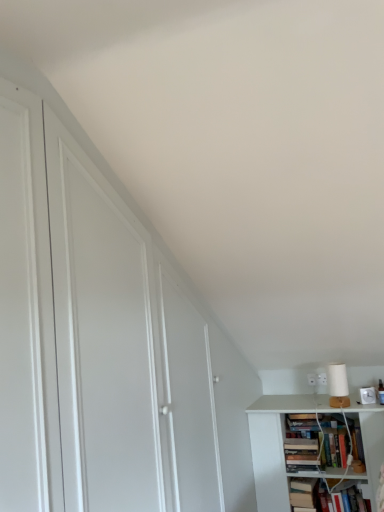
Where is `white matte lamp at upper right`? This screenshot has width=384, height=512. white matte lamp at upper right is located at coordinates point(338,385).

What are the coordinates of `hardcover book at lower right, the second book when ordered from right to left` in the screenshot? It's located at (303, 492).

Identify the location of white matte lamp at upper right. (338, 385).

Does white matte lamp at upper right contain hardcover book at lower right, which ranks as the second book in left-to-right order?

No.

From the image's perspective, is white matte lamp at upper right above hardcover book at lower right, which is counted as the first book, starting from the right?

Yes, from the image's perspective, white matte lamp at upper right is on top of hardcover book at lower right, which is counted as the first book, starting from the right.

Does point (340, 380) lie behind point (309, 505)?

Yes, it is.

Does white matte lamp at upper right have a lesser height compared to hardcover book at lower right, which ranks as the second book in left-to-right order?

Incorrect, the height of white matte lamp at upper right does not fall short of that of hardcover book at lower right, which ranks as the second book in left-to-right order.

Identify the location of book that is the 2nd one when counting forward from the white matte lamp at upper right. The height and width of the screenshot is (512, 384). (326, 496).

Consider the image. Considering the sizes of objects hardcover book at lower right, which ranks as the second book in left-to-right order, and white matte lamp at upper right in the image provided, who is taller, hardcover book at lower right, which ranks as the second book in left-to-right order, or white matte lamp at upper right?

white matte lamp at upper right.

From a real-world perspective, which object rests below the other?

From a 3D spatial view, hardcover book at lower right, which ranks as the second book in left-to-right order, is below.

Is hardcover book at lower right, which is the first book in left-to-right order, beside white matte lamp at upper right?

No, hardcover book at lower right, which is the first book in left-to-right order, is not in contact with white matte lamp at upper right.

Is hardcover book at lower right, the second book when ordered from right to left, positioned beyond the bounds of white matte lamp at upper right?

Absolutely, hardcover book at lower right, the second book when ordered from right to left, is external to white matte lamp at upper right.

Does hardcover book at lower right, which is the first book in left-to-right order, have a greater height compared to white matte lamp at upper right?

Yes, hardcover book at lower right, which is the first book in left-to-right order, is taller than white matte lamp at upper right.

From the image's perspective, is hardcover book at lower right, which ranks as the second book in left-to-right order, on top of hardcover book at lower right, which is the first book in left-to-right order?

No, from the image's perspective, hardcover book at lower right, which ranks as the second book in left-to-right order, is not above hardcover book at lower right, which is the first book in left-to-right order.

Which object is positioned more to the right, hardcover book at lower right, which is counted as the first book, starting from the right, or hardcover book at lower right, which is the first book in left-to-right order?

From the viewer's perspective, hardcover book at lower right, which is counted as the first book, starting from the right, appears more on the right side.

In order to click on book below the hardcover book at lower right, which is the first book in left-to-right order (from a real-world perspective) in this screenshot , I will do `click(326, 496)`.

Can you see hardcover book at lower right, which ranks as the second book in left-to-right order, touching hardcover book at lower right, the second book when ordered from right to left?

Absolutely, hardcover book at lower right, which ranks as the second book in left-to-right order, is next to and touching hardcover book at lower right, the second book when ordered from right to left.

Is white matte lamp at upper right to the left or to the right of hardcover book at lower right, which is the first book in left-to-right order, in the image?

Clearly, white matte lamp at upper right is on the right of hardcover book at lower right, which is the first book in left-to-right order, in the image.

From the image's perspective, would you say white matte lamp at upper right is shown under hardcover book at lower right, which is the first book in left-to-right order?

Actually, white matte lamp at upper right appears above hardcover book at lower right, which is the first book in left-to-right order, in the image.

Consider the image. Considering the sizes of objects white matte lamp at upper right and hardcover book at lower right, which is the first book in left-to-right order, in the image provided, who is smaller, white matte lamp at upper right or hardcover book at lower right, which is the first book in left-to-right order,?

white matte lamp at upper right is smaller.

From a real-world perspective, is white matte lamp at upper right on top of hardcover book at lower right, the second book when ordered from right to left?

Yes, from a real-world perspective, white matte lamp at upper right is on top of hardcover book at lower right, the second book when ordered from right to left.

Where is `book located in front of the hardcover book at lower right, which is the first book in left-to-right order`? book located in front of the hardcover book at lower right, which is the first book in left-to-right order is located at coordinates (326, 496).

In the scene shown: Is hardcover book at lower right, which is the first book in left-to-right order, in front of hardcover book at lower right, which ranks as the second book in left-to-right order?

No, hardcover book at lower right, which is the first book in left-to-right order, is behind hardcover book at lower right, which ranks as the second book in left-to-right order.

Does hardcover book at lower right, which is the first book in left-to-right order, have a greater height compared to hardcover book at lower right, which is counted as the first book, starting from the right?

Yes, hardcover book at lower right, which is the first book in left-to-right order, is taller than hardcover book at lower right, which is counted as the first book, starting from the right.

Image resolution: width=384 pixels, height=512 pixels. In order to click on book to the right of white matte lamp at upper right in this screenshot , I will do `click(326, 496)`.

From a real-world perspective, count 2nd books downward from the white matte lamp at upper right and point to it. Please provide its 2D coordinates.

[(326, 496)]

When comparing their distances from white matte lamp at upper right, does hardcover book at lower right, the second book when ordered from right to left, or hardcover book at lower right, which is counted as the first book, starting from the right, seem further?

hardcover book at lower right, the second book when ordered from right to left, is further to white matte lamp at upper right.

Considering their positions, is hardcover book at lower right, which is the first book in left-to-right order, positioned closer to hardcover book at lower right, which ranks as the second book in left-to-right order, than white matte lamp at upper right?

hardcover book at lower right, which is the first book in left-to-right order, is positioned closer to the anchor hardcover book at lower right, which ranks as the second book in left-to-right order.

Which object lies further to the anchor point white matte lamp at upper right, hardcover book at lower right, which ranks as the second book in left-to-right order, or hardcover book at lower right, the second book when ordered from right to left?

The object further to white matte lamp at upper right is hardcover book at lower right, the second book when ordered from right to left.

Which object lies further to the anchor point hardcover book at lower right, the second book when ordered from right to left, white matte lamp at upper right or hardcover book at lower right, which ranks as the second book in left-to-right order?

Based on the image, white matte lamp at upper right appears to be further to hardcover book at lower right, the second book when ordered from right to left.

Based on their spatial positions, is hardcover book at lower right, which ranks as the second book in left-to-right order, or white matte lamp at upper right closer to hardcover book at lower right, the second book when ordered from right to left?

hardcover book at lower right, which ranks as the second book in left-to-right order, is closer to hardcover book at lower right, the second book when ordered from right to left.

Looking at the image, which one is located closer to hardcover book at lower right, which is counted as the first book, starting from the right, white matte lamp at upper right or hardcover book at lower right, the second book when ordered from right to left?

hardcover book at lower right, the second book when ordered from right to left.

At what (x,y) coordinates should I click in order to perform the action: click on book between white matte lamp at upper right and hardcover book at lower right, which ranks as the second book in left-to-right order, from top to bottom. Please return your answer as a coordinate pair (x, y). Looking at the image, I should click on (303, 492).